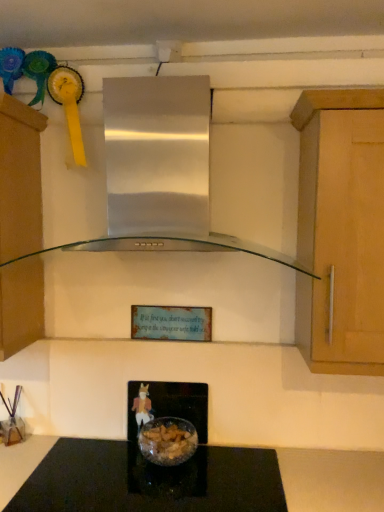
Find the location of `black glass countertop at center`. black glass countertop at center is located at coordinates (332, 479).

Measure the distance between point (117, 167) and camera.

A distance of 1.29 meters exists between point (117, 167) and camera.

Locate an element on the screen. translucent glass bowl at center is located at coordinates (168, 441).

Is translucent glass bowl at center at the back of matte brown cabinet at left?

No.

The height and width of the screenshot is (512, 384). Identify the location of cabinetry on the left of the translucent glass bowl at center. (x=20, y=179).

Does matte brown cabinet at left have a greater height compared to translucent glass bowl at center?

Correct, matte brown cabinet at left is much taller as translucent glass bowl at center.

From a real-world perspective, which object rests below the other?

From a 3D spatial view, translucent glass bowl at center is below.

Is matte brown cabinet at left not inside stainless steel range hood at center?

matte brown cabinet at left lies outside stainless steel range hood at center's area.

Consider the image. From a real-world perspective, which object stands above the other?

stainless steel range hood at center, from a real-world perspective.

Does matte brown cabinet at left have a larger size compared to stainless steel range hood at center?

No, matte brown cabinet at left is not bigger than stainless steel range hood at center.

Are black glass countertop at center and matte brown cabinet at left beside each other?

No, black glass countertop at center is not touching matte brown cabinet at left.

This screenshot has width=384, height=512. In the image, there is a black glass countertop at center. Identify the location of cabinetry above it (from the image's perspective). (20, 179).

Relative to matte brown cabinet at left, is black glass countertop at center in front or behind?

In the image, black glass countertop at center appears in front of matte brown cabinet at left.

Considering the relative positions of black glass countertop at center and matte brown cabinet at left in the image provided, is black glass countertop at center to the left of matte brown cabinet at left from the viewer's perspective?

Incorrect, black glass countertop at center is not on the left side of matte brown cabinet at left.

Is translucent glass bowl at center aimed at matte brown cabinet at left?

No, translucent glass bowl at center is not turned towards matte brown cabinet at left.

Considering the sizes of objects translucent glass bowl at center and matte brown cabinet at left in the image provided, who is wider, translucent glass bowl at center or matte brown cabinet at left?

matte brown cabinet at left is wider.

Is translucent glass bowl at center smaller than matte brown cabinet at left?

Yes, translucent glass bowl at center is smaller than matte brown cabinet at left.

From a real-world perspective, which is physically below, translucent glass bowl at center or matte brown cabinet at left?

translucent glass bowl at center, from a real-world perspective.

From the image's perspective, is translucent glass bowl at center positioned above or below black glass countertop at center?

Answer: translucent glass bowl at center is above black glass countertop at center.

Is point (162, 420) positioned behind point (319, 467)?

Yes, point (162, 420) is behind point (319, 467).

Does translucent glass bowl at center lie in front of black glass countertop at center?

No, the depth of translucent glass bowl at center is greater than that of black glass countertop at center.

From a real-world perspective, does black glass countertop at center sit lower than stainless steel range hood at center?

Indeed, from a real-world perspective, black glass countertop at center is positioned beneath stainless steel range hood at center.

Is black glass countertop at center beside stainless steel range hood at center?

black glass countertop at center and stainless steel range hood at center are clearly separated.

From the image's perspective, relative to stainless steel range hood at center, is black glass countertop at center above or below?

black glass countertop at center is situated lower than stainless steel range hood at center in the image.

Considering the positions of points (364, 457) and (123, 83), is point (364, 457) farther from camera compared to point (123, 83)?

Yes.

From the image's perspective, is stainless steel range hood at center above or below matte brown cabinet at left?

stainless steel range hood at center is situated higher than matte brown cabinet at left in the image.

Is matte brown cabinet at left at the back of stainless steel range hood at center?

No, matte brown cabinet at left is not at the back of stainless steel range hood at center.

Can you tell me how much stainless steel range hood at center and matte brown cabinet at left differ in facing direction?

The angle between the facing direction of stainless steel range hood at center and the facing direction of matte brown cabinet at left is 0.632 degrees.

You are a GUI agent. You are given a task and a screenshot of the screen. Output one action in this format:
    pyautogui.click(x=<x>, y=<y>)
    Task: Click on the cabinetry that is on the left side of translucent glass bowl at center
    
    Given the screenshot: What is the action you would take?
    pyautogui.click(x=20, y=179)

The height and width of the screenshot is (512, 384). I want to click on cabinetry lying below the stainless steel range hood at center (from the image's perspective), so click(20, 179).

Estimate the real-world distances between objects in this image. Which object is closer to stainless steel range hood at center, matte brown cabinet at left or translucent glass bowl at center?

matte brown cabinet at left is positioned closer to the anchor stainless steel range hood at center.

Estimate the real-world distances between objects in this image. Which object is closer to translucent glass bowl at center, matte brown cabinet at left or stainless steel range hood at center?

matte brown cabinet at left is closer to translucent glass bowl at center.

Looking at the image, which one is located further to black glass countertop at center, stainless steel range hood at center or matte brown cabinet at left?

matte brown cabinet at left.

Estimate the real-world distances between objects in this image. Which object is further from black glass countertop at center, stainless steel range hood at center or translucent glass bowl at center?

stainless steel range hood at center is further to black glass countertop at center.

Looking at the image, which one is located further to black glass countertop at center, translucent glass bowl at center or matte brown cabinet at left?

matte brown cabinet at left is positioned further to the anchor black glass countertop at center.

From the image, which object appears to be farther from translucent glass bowl at center, stainless steel range hood at center or matte brown cabinet at left?

The object further to translucent glass bowl at center is stainless steel range hood at center.

Considering their positions, is stainless steel range hood at center positioned closer to matte brown cabinet at left than translucent glass bowl at center?

stainless steel range hood at center is positioned closer to the anchor matte brown cabinet at left.

Which object lies further to the anchor point stainless steel range hood at center, matte brown cabinet at left or black glass countertop at center?

Among the two, black glass countertop at center is located further to stainless steel range hood at center.

Find the location of a particular element. food between matte brown cabinet at left and black glass countertop at center vertically is located at coordinates (168, 441).

Locate an element on the screen. The height and width of the screenshot is (512, 384). cabinetry between stainless steel range hood at center and black glass countertop at center vertically is located at coordinates (20, 179).

Where is `cabinetry between stainless steel range hood at center and translucent glass bowl at center vertically`? cabinetry between stainless steel range hood at center and translucent glass bowl at center vertically is located at coordinates (20, 179).

Find the location of a particular element. The image size is (384, 512). food that lies between stainless steel range hood at center and black glass countertop at center from top to bottom is located at coordinates (168, 441).